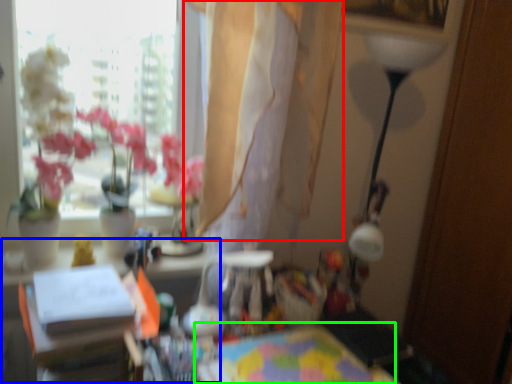
Question: Based on their relative distances, which object is farther from curtain (highlighted by a red box)? Choose from table (highlighted by a blue box) and table (highlighted by a green box).

Choices:
 (A) table
 (B) table

Answer: (B)